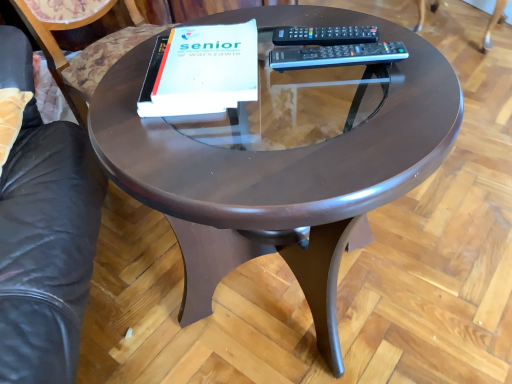
You are a GUI agent. You are given a task and a screenshot of the screen. Output one action in this format:
    pyautogui.click(x=<x>, y=<y>)
    Task: Click on the vacant point to the right of black plastic remote at upper right, which ranks as the first remote in bottom-to-top order
    
    Given the screenshot: What is the action you would take?
    pyautogui.click(x=415, y=59)